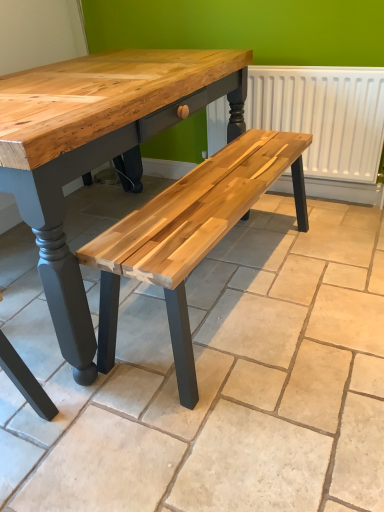
The image size is (384, 512). What do you see at coordinates (214, 379) in the screenshot?
I see `natural wood bench at center` at bounding box center [214, 379].

I want to click on natural wood bench at center, so click(x=214, y=379).

The width and height of the screenshot is (384, 512). What are the coordinates of `white matte radiator at upper right` in the screenshot? It's located at (323, 115).

The height and width of the screenshot is (512, 384). What do you see at coordinates (323, 115) in the screenshot? I see `white matte radiator at upper right` at bounding box center [323, 115].

Locate an element on the screen. natural wood bench at center is located at coordinates (214, 379).

Is natural wood bench at center at the left side of white matte radiator at upper right?

Indeed, natural wood bench at center is positioned on the left side of white matte radiator at upper right.

From the picture: Considering their positions, is natural wood bench at center located in front of or behind white matte radiator at upper right?

natural wood bench at center is in front of white matte radiator at upper right.

Does point (350, 329) lie in front of point (284, 78)?

Yes, point (350, 329) is in front of point (284, 78).

From the image's perspective, would you say natural wood bench at center is shown under white matte radiator at upper right?

Yes, from the image's perspective, natural wood bench at center is below white matte radiator at upper right.

From a real-world perspective, is natural wood bench at center above or below white matte radiator at upper right?

From a real-world perspective, natural wood bench at center is physically below white matte radiator at upper right.

Does natural wood bench at center have a lesser width compared to white matte radiator at upper right?

In fact, natural wood bench at center might be wider than white matte radiator at upper right.

Can you confirm if natural wood bench at center is taller than white matte radiator at upper right?

No.

In terms of size, does natural wood bench at center appear bigger or smaller than white matte radiator at upper right?

natural wood bench at center is bigger than white matte radiator at upper right.

Do you think natural wood bench at center is within white matte radiator at upper right, or outside of it?

natural wood bench at center cannot be found inside white matte radiator at upper right.

Can you see natural wood bench at center touching white matte radiator at upper right?

No, natural wood bench at center is not in contact with white matte radiator at upper right.

Is natural wood bench at center looking in the opposite direction of white matte radiator at upper right?

natural wood bench at center does not have its back to white matte radiator at upper right.

How different are the orientations of natural wood bench at center and white matte radiator at upper right in degrees?

The facing directions of natural wood bench at center and white matte radiator at upper right are 89.3 degrees apart.

In order to click on radiator on the right side of natural wood bench at center in this screenshot , I will do `click(323, 115)`.

Which object is positioned more to the left, white matte radiator at upper right or natural wood bench at center?

natural wood bench at center is more to the left.

Based on the photo, does white matte radiator at upper right come behind natural wood bench at center?

Yes, the depth of white matte radiator at upper right is greater than that of natural wood bench at center.

Does point (270, 112) come farther from viewer compared to point (298, 509)?

Yes, point (270, 112) is behind point (298, 509).

From the image's perspective, which one is positioned higher, white matte radiator at upper right or natural wood bench at center?

white matte radiator at upper right, from the image's perspective.

From a real-world perspective, is white matte radiator at upper right positioned under natural wood bench at center based on gravity?

Incorrect, from a real-world perspective, white matte radiator at upper right is higher than natural wood bench at center.

Considering the sizes of objects white matte radiator at upper right and natural wood bench at center in the image provided, who is wider, white matte radiator at upper right or natural wood bench at center?

Wider between the two is natural wood bench at center.

In the scene shown: Does white matte radiator at upper right have a greater height compared to natural wood bench at center?

Indeed, white matte radiator at upper right has a greater height compared to natural wood bench at center.

Which of these two, white matte radiator at upper right or natural wood bench at center, is smaller?

Smaller between the two is white matte radiator at upper right.

Is white matte radiator at upper right outside of natural wood bench at center?

white matte radiator at upper right is positioned outside natural wood bench at center.

Is white matte radiator at upper right placed right next to natural wood bench at center?

white matte radiator at upper right is not next to natural wood bench at center, and they're not touching.

Does white matte radiator at upper right turn towards natural wood bench at center?

Yes, white matte radiator at upper right is aimed at natural wood bench at center.

Can you tell me how much white matte radiator at upper right and natural wood bench at center differ in facing direction?

The angle between the facing direction of white matte radiator at upper right and the facing direction of natural wood bench at center is 89.3 degrees.

I want to click on tile in front of the white matte radiator at upper right, so click(214, 379).

The image size is (384, 512). In order to click on tile below the white matte radiator at upper right (from the image's perspective) in this screenshot , I will do `click(214, 379)`.

You are a GUI agent. You are given a task and a screenshot of the screen. Output one action in this format:
    pyautogui.click(x=<x>, y=<y>)
    Task: Click on the tile located in front of the white matte radiator at upper right
    
    Given the screenshot: What is the action you would take?
    pos(214,379)